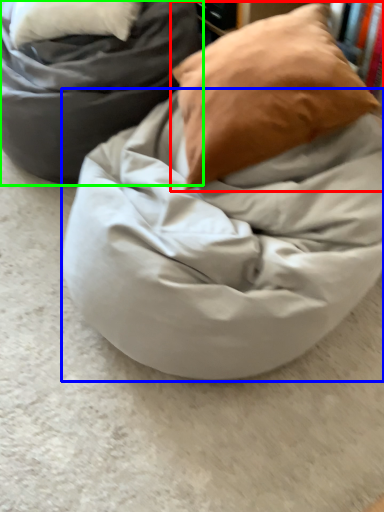
Question: Which is nearer to the pillow (highlighted by a red box)? blanket (highlighted by a blue box) or furniture (highlighted by a green box).

Choices:
 (A) blanket
 (B) furniture

Answer: (A)